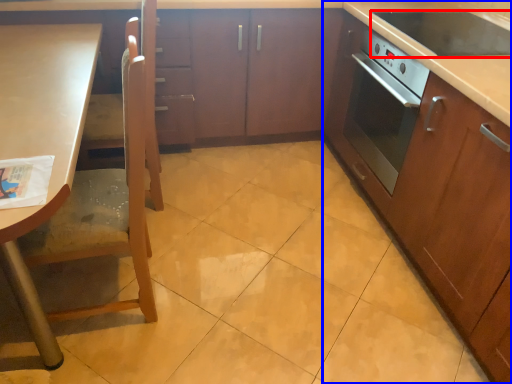
Question: Which of the following is the closest to the observer, kitchen appliance (highlighted by a red box) or cabinetry (highlighted by a blue box)?

Choices:
 (A) kitchen appliance
 (B) cabinetry

Answer: (B)